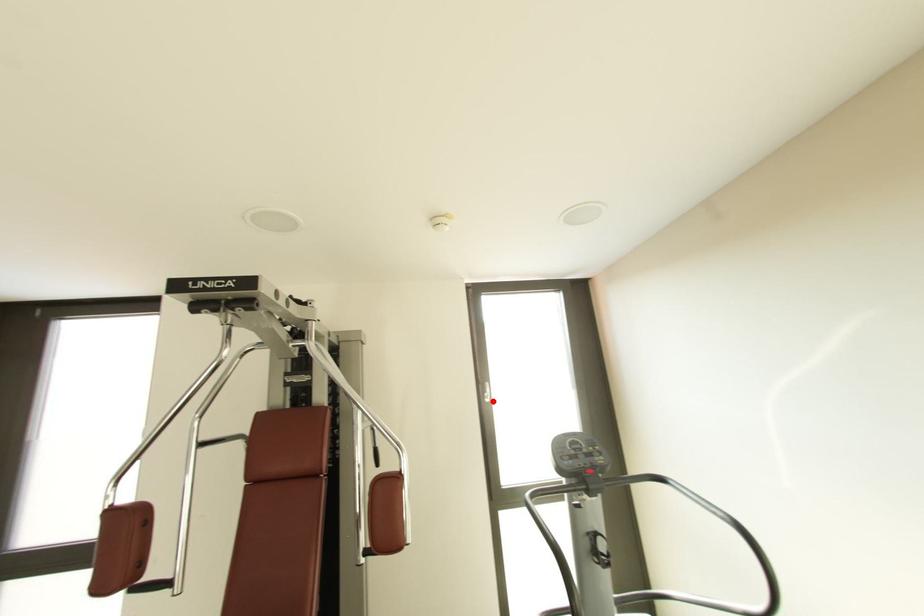
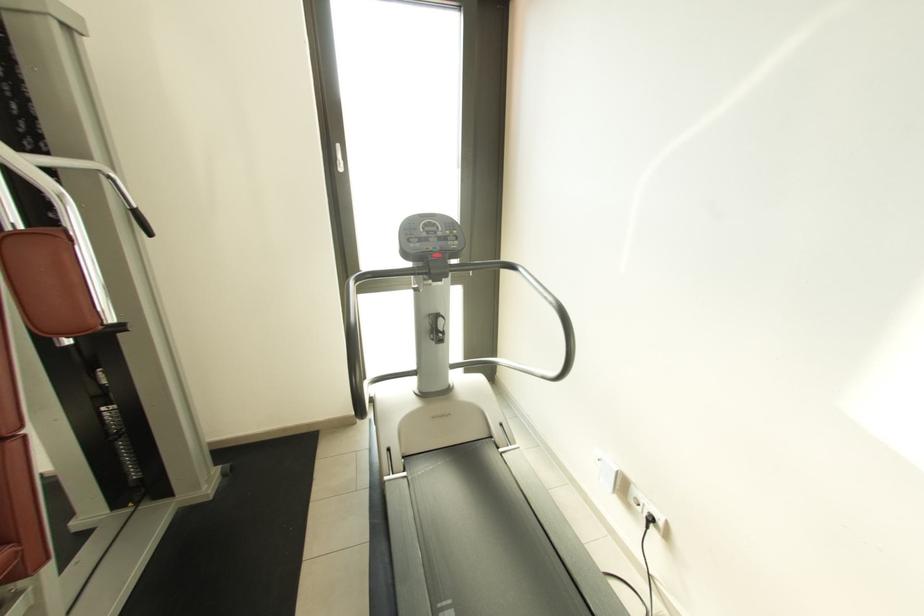
Find the pixel in the second image that matches the highlighted location in the first image.

(345, 171)